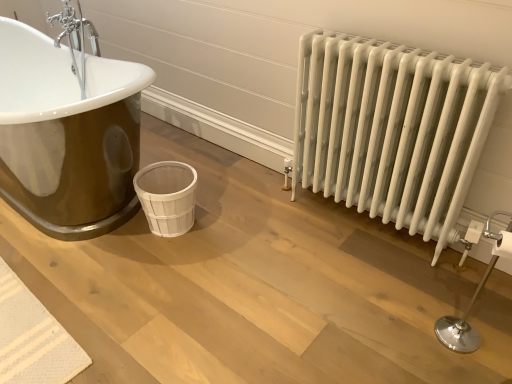
I want to click on white painted metal radiator at right, so click(392, 129).

Describe the element at coordinates (392, 129) in the screenshot. The width and height of the screenshot is (512, 384). I see `white painted metal radiator at right` at that location.

Where is `white painted metal radiator at right`? white painted metal radiator at right is located at coordinates point(392,129).